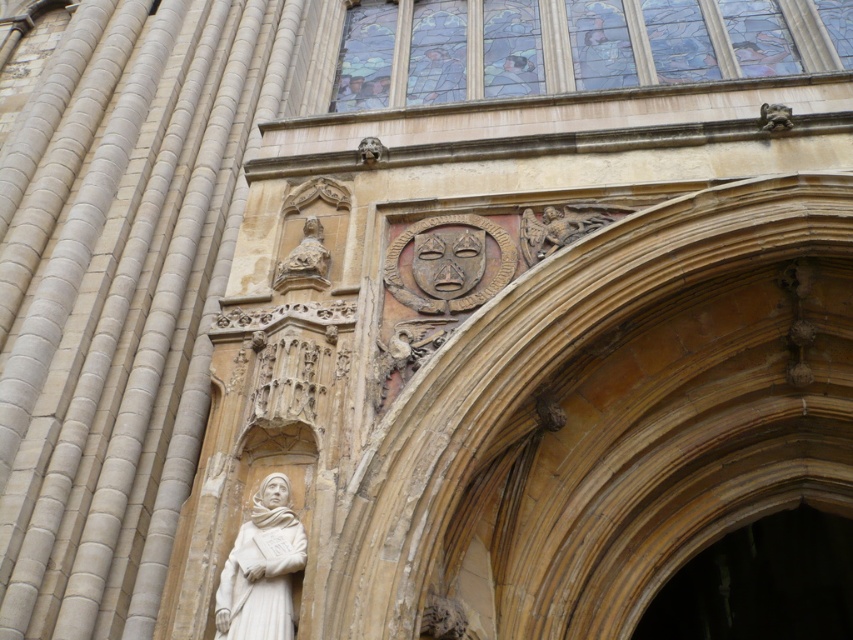
You are standing in front of the historic building and want to take a photo of the decorative panel above the arched doorway. The camera you are using has a maximum focus range of 70 meters. Will the point at coordinates point [675,616] be in focus?

The point at coordinates point [675,616] is 73.23 meters away from the camera, which exceeds the camera maximum focus range of 70 meters. Therefore, the point will not be in focus.

You are standing in front of the historic building and notice two points marked on the image. The first point is at coordinates point (598, 1) and the second point is at point (314, 253). Which point is closer to you?

Point (314, 253) is closer to you because it is in front of point (598, 1).

You are standing in front of the historic building and want to take a photo. You notice two points marked in the scene. The first point is at coordinates point [647,72] and the second is at point [844,627]. Which point is closer to your camera lens when taking the photo?

Point [647,72] is further to the camera than point [844,627]. Therefore, point [844,627] is closer to the camera lens.